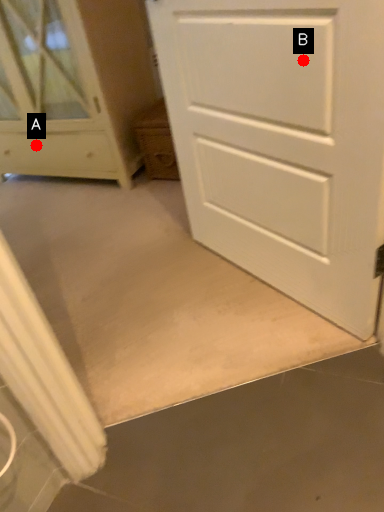
Question: Two points are circled on the image, labeled by A and B beside each circle. Which point is closer to the camera?

Choices:
 (A) A is closer
 (B) B is closer

Answer: (B)